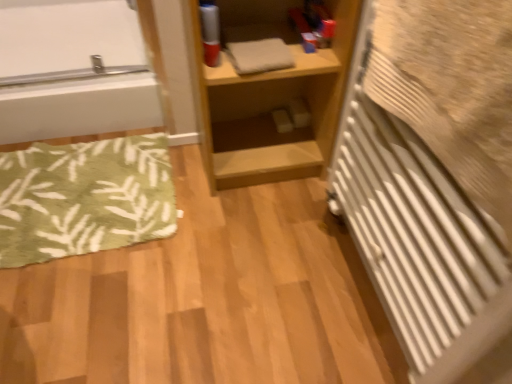
This screenshot has width=512, height=384. Identify the location of white glossy bathtub at upper left. (68, 36).

You are a GUI agent. You are given a task and a screenshot of the screen. Output one action in this format:
    pyautogui.click(x=<x>, y=<y>)
    Task: Click on the light wood shelf at center
    
    Given the screenshot: What is the action you would take?
    pyautogui.click(x=270, y=96)

Is green leafy rug at lower left smaller than white glossy bathtub at upper left?

Yes.

From a real-world perspective, between green leafy rug at lower left and white glossy bathtub at upper left, who is vertically lower?

green leafy rug at lower left, from a real-world perspective.

Does point (17, 183) appear closer or farther from the camera than point (108, 6)?

Point (17, 183).

In terms of width, does green leafy rug at lower left look wider or thinner when compared to white glossy bathtub at upper left?

In the image, green leafy rug at lower left appears to be more narrow than white glossy bathtub at upper left.

Is green leafy rug at lower left placed right next to white textured radiator at right?

There is a gap between green leafy rug at lower left and white textured radiator at right.

Considering the positions of objects green leafy rug at lower left and white textured radiator at right in the image provided, who is more to the right, green leafy rug at lower left or white textured radiator at right?

white textured radiator at right.

How far apart are green leafy rug at lower left and white textured radiator at right?

A distance of 32.52 inches exists between green leafy rug at lower left and white textured radiator at right.

Which of these two, green leafy rug at lower left or white textured radiator at right, is thinner?

With smaller width is white textured radiator at right.

From the image's perspective, relative to green leafy rug at lower left, is white textured radiator at right above or below?

Based on their image positions, white textured radiator at right is located beneath green leafy rug at lower left.

Is white textured radiator at right oriented towards green leafy rug at lower left?

No, white textured radiator at right is not oriented towards green leafy rug at lower left.

Looking at the image, does white textured radiator at right seem bigger or smaller compared to green leafy rug at lower left?

white textured radiator at right is bigger than green leafy rug at lower left.

From a real-world perspective, is white textured radiator at right located beneath green leafy rug at lower left?

No, from a real-world perspective, white textured radiator at right is not below green leafy rug at lower left.

Considering the relative sizes of white textured radiator at right and light wood shelf at center in the image provided, is white textured radiator at right shorter than light wood shelf at center?

Incorrect, the height of white textured radiator at right does not fall short of that of light wood shelf at center.

At what (x,y) coordinates should I click in order to perform the action: click on shelf behind the white textured radiator at right. Please return your answer as a coordinate pair (x, y). This screenshot has width=512, height=384. Looking at the image, I should click on (270, 96).

Is white textured radiator at right not near light wood shelf at center?

No, there isn't a large distance between white textured radiator at right and light wood shelf at center.

Looking at this image, can you tell me how much white textured radiator at right and light wood shelf at center differ in facing direction?

87.5 degrees separate the facing orientations of white textured radiator at right and light wood shelf at center.

Does white glossy bathtub at upper left have a lesser height compared to green leafy rug at lower left?

Incorrect, the height of white glossy bathtub at upper left does not fall short of that of green leafy rug at lower left.

From a real-world perspective, is white glossy bathtub at upper left physically located above or below green leafy rug at lower left?

white glossy bathtub at upper left is situated higher than green leafy rug at lower left in the real world.

Considering the sizes of objects white glossy bathtub at upper left and green leafy rug at lower left in the image provided, who is bigger, white glossy bathtub at upper left or green leafy rug at lower left?

white glossy bathtub at upper left is bigger.

Can you confirm if white glossy bathtub at upper left is wider than green leafy rug at lower left?

Indeed, white glossy bathtub at upper left has a greater width compared to green leafy rug at lower left.

You are a GUI agent. You are given a task and a screenshot of the screen. Output one action in this format:
    pyautogui.click(x=<x>, y=<y>)
    Task: Click on the shelf above the white textured radiator at right (from the image's perspective)
    This screenshot has width=512, height=384.
    Given the screenshot: What is the action you would take?
    pyautogui.click(x=270, y=96)

From the picture: Considering their positions, is light wood shelf at center located in front of or behind white textured radiator at right?

Clearly, light wood shelf at center is behind white textured radiator at right.

Which is closer, (x=283, y=143) or (x=394, y=304)?

Point (x=283, y=143) is farther from the camera than point (x=394, y=304).

Based on the photo, would you say green leafy rug at lower left is part of light wood shelf at center's contents?

No, light wood shelf at center does not contain green leafy rug at lower left.

Is light wood shelf at center in front of or behind green leafy rug at lower left in the image?

Clearly, light wood shelf at center is in front of green leafy rug at lower left.

Is light wood shelf at center oriented away from green leafy rug at lower left?

No.

Where is `bathtub behind the green leafy rug at lower left`? This screenshot has width=512, height=384. bathtub behind the green leafy rug at lower left is located at coordinates (68, 36).

Image resolution: width=512 pixels, height=384 pixels. Identify the location of radiator in front of the green leafy rug at lower left. (434, 180).

Looking at the image, which one is located further to green leafy rug at lower left, white textured radiator at right or white glossy bathtub at upper left?

white textured radiator at right.

When comparing their distances from light wood shelf at center, does white glossy bathtub at upper left or green leafy rug at lower left seem closer?

green leafy rug at lower left lies closer to light wood shelf at center than the other object.

Considering their positions, is light wood shelf at center positioned closer to green leafy rug at lower left than white textured radiator at right?

Among the two, light wood shelf at center is located nearer to green leafy rug at lower left.

Considering their positions, is white glossy bathtub at upper left positioned closer to white textured radiator at right than green leafy rug at lower left?

green leafy rug at lower left lies closer to white textured radiator at right than the other object.

Which object lies nearer to the anchor point light wood shelf at center, green leafy rug at lower left or white textured radiator at right?

Based on the image, green leafy rug at lower left appears to be nearer to light wood shelf at center.

Which object lies further to the anchor point light wood shelf at center, white glossy bathtub at upper left or white textured radiator at right?

white glossy bathtub at upper left lies further to light wood shelf at center than the other object.

When comparing their distances from green leafy rug at lower left, does white glossy bathtub at upper left or light wood shelf at center seem closer?

white glossy bathtub at upper left is closer to green leafy rug at lower left.

Considering their positions, is light wood shelf at center positioned closer to green leafy rug at lower left than white glossy bathtub at upper left?

The object closer to green leafy rug at lower left is white glossy bathtub at upper left.

Locate an element on the screen. This screenshot has height=384, width=512. bath mat situated between white glossy bathtub at upper left and white textured radiator at right from left to right is located at coordinates (84, 198).

In order to click on bath mat located between white glossy bathtub at upper left and light wood shelf at center in the left-right direction in this screenshot , I will do `click(84, 198)`.

Locate an element on the screen. shelf between white glossy bathtub at upper left and white textured radiator at right is located at coordinates (270, 96).

The width and height of the screenshot is (512, 384). Identify the location of shelf between green leafy rug at lower left and white textured radiator at right from left to right. (270, 96).